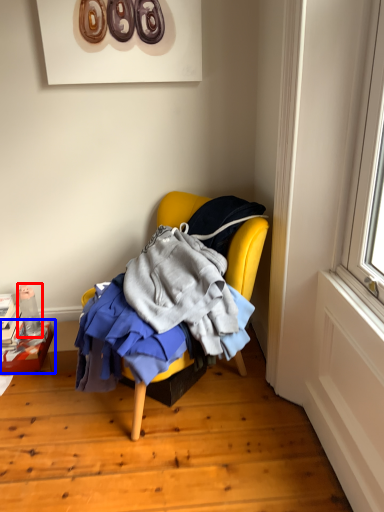
Question: Among these objects, which one is nearest to the camera, bottle (highlighted by a red box) or box (highlighted by a blue box)?

Choices:
 (A) bottle
 (B) box

Answer: (B)